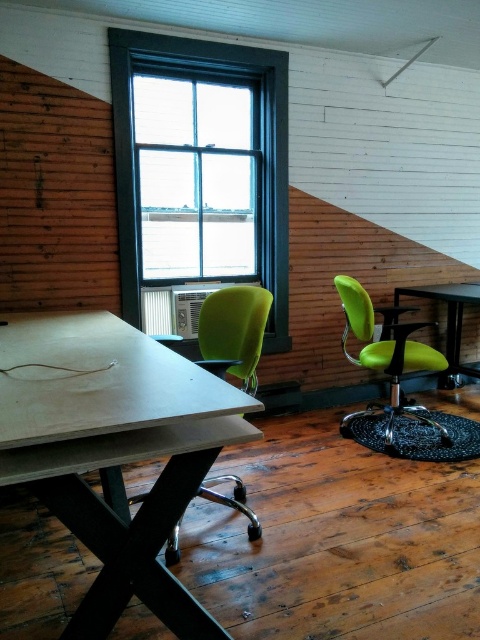
Who is lower down, matte green swivel chair at right or matte black table at center?

matte green swivel chair at right is lower down.

Is point (364, 332) positioned before point (418, 296)?

Yes, it is in front of point (418, 296).

Describe the element at coordinates (386, 362) in the screenshot. I see `matte green swivel chair at right` at that location.

Where is `matte green swivel chair at right`? matte green swivel chair at right is located at coordinates (386, 362).

The image size is (480, 640). I want to click on matte white table at center, so click(113, 451).

Is matte white table at center positioned in front of matte green swivel chair at right?

Yes, it is in front of matte green swivel chair at right.

Does point (160, 499) come farther from viewer compared to point (337, 285)?

That is False.

Locate an element on the screen. The width and height of the screenshot is (480, 640). matte white table at center is located at coordinates (113, 451).

Can you confirm if matte white table at center is taller than matte black table at center?

Correct, matte white table at center is much taller as matte black table at center.

Does matte white table at center have a smaller size compared to matte black table at center?

No, matte white table at center is not smaller than matte black table at center.

The image size is (480, 640). What do you see at coordinates (113, 451) in the screenshot?
I see `matte white table at center` at bounding box center [113, 451].

You are a GUI agent. You are given a task and a screenshot of the screen. Output one action in this format:
    pyautogui.click(x=<x>, y=<y>)
    Task: Click on the matte white table at center
    This screenshot has height=640, width=480.
    Given the screenshot: What is the action you would take?
    pyautogui.click(x=113, y=451)